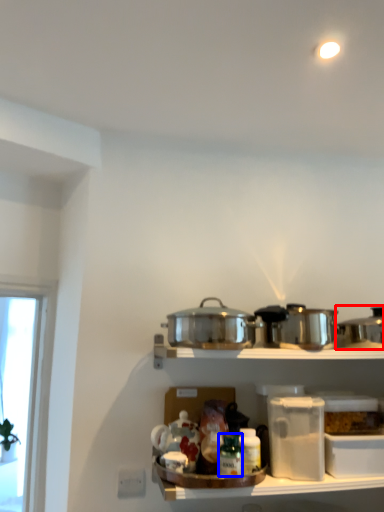
Question: Which of the following is the farthest to the observer, crock pot (highlighted by a red box) or bottle (highlighted by a blue box)?

Choices:
 (A) crock pot
 (B) bottle

Answer: (A)